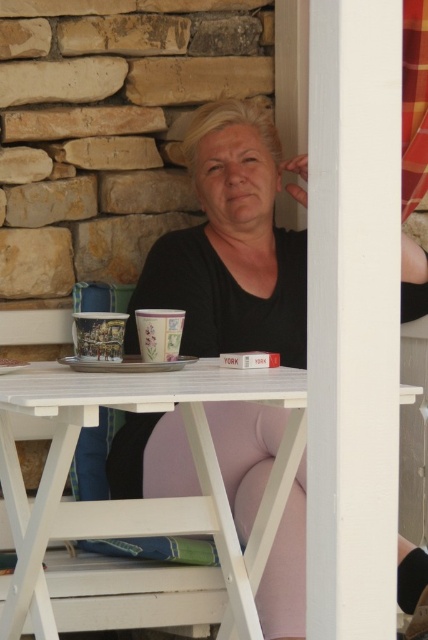
You are standing at the woman in the image and want to place a new cup between the two points, point (x=377, y=19) and point (x=101, y=387). Which point should you place the cup closer to so that it is between them?

To place the cup between point (x=377, y=19) and point (x=101, y=387), you should place it closer to point (x=377, y=19) since it is in front of the other point.

From the picture: You are a painter standing in front of the white painted wood at right and the matte black shirt at center. Which object is taller?

The white painted wood at right is taller than the matte black shirt at center.

You are a painter standing at the edge of the scene, looking towards the white painted wood at right and the white wood picnic table at center. Which object is taller from your viewpoint?

The white painted wood at right is taller than the white wood picnic table at center.